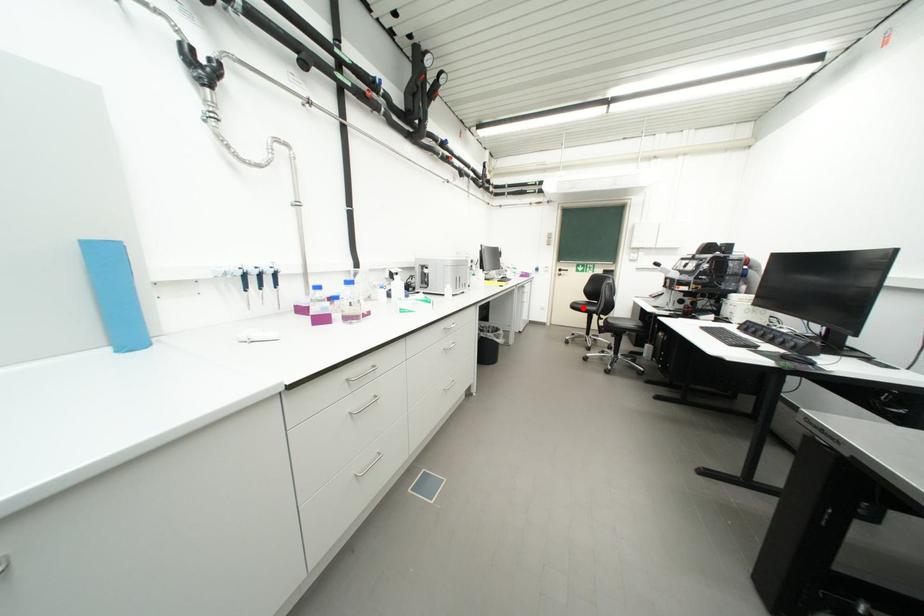
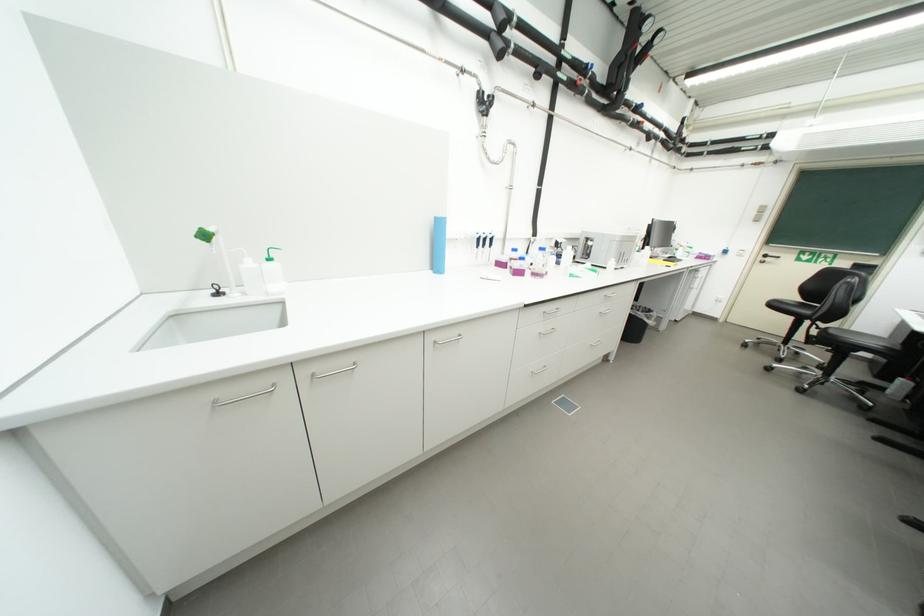
Question: I am providing you with two images of the same scene from different viewpoints. A red point is shown in image1. For the corresponding object point in image2, is it positioned nearer or farther from the camera?

Choices:
 (A) Nearer
 (B) Farther

Answer: (B)